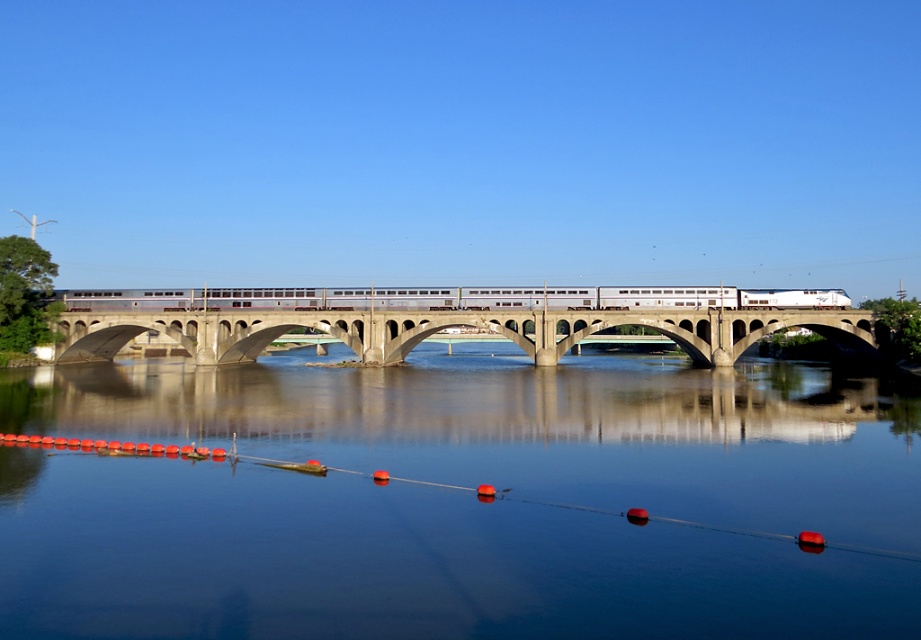
Is smooth water at center further to the viewer compared to concrete bridge at center?

No, it is not.

Who is shorter, smooth water at center or concrete bridge at center?

With less height is smooth water at center.

At what (x,y) coordinates should I click in order to perform the action: click on smooth water at center. Please return your answer as a coordinate pair (x, y). Looking at the image, I should click on (462, 500).

Identify the location of smooth water at center. This screenshot has width=921, height=640. (462, 500).

Based on the photo, who is higher up, smooth water at center or silver metallic train at center?

silver metallic train at center is above.

Who is lower down, smooth water at center or silver metallic train at center?

Positioned lower is smooth water at center.

The height and width of the screenshot is (640, 921). Identify the location of smooth water at center. (462, 500).

At what (x,y) coordinates should I click in order to perform the action: click on smooth water at center. Please return your answer as a coordinate pair (x, y). This screenshot has height=640, width=921. Looking at the image, I should click on (462, 500).

How distant is concrete bridge at center from silver metallic train at center?

A distance of 5.72 meters exists between concrete bridge at center and silver metallic train at center.

Does concrete bridge at center come in front of silver metallic train at center?

Yes, concrete bridge at center is in front of silver metallic train at center.

Which is behind, point (493, 323) or point (760, 292)?

Positioned behind is point (760, 292).

At what (x,y) coordinates should I click in order to perform the action: click on concrete bridge at center. Please return your answer as a coordinate pair (x, y). Looking at the image, I should click on (451, 326).